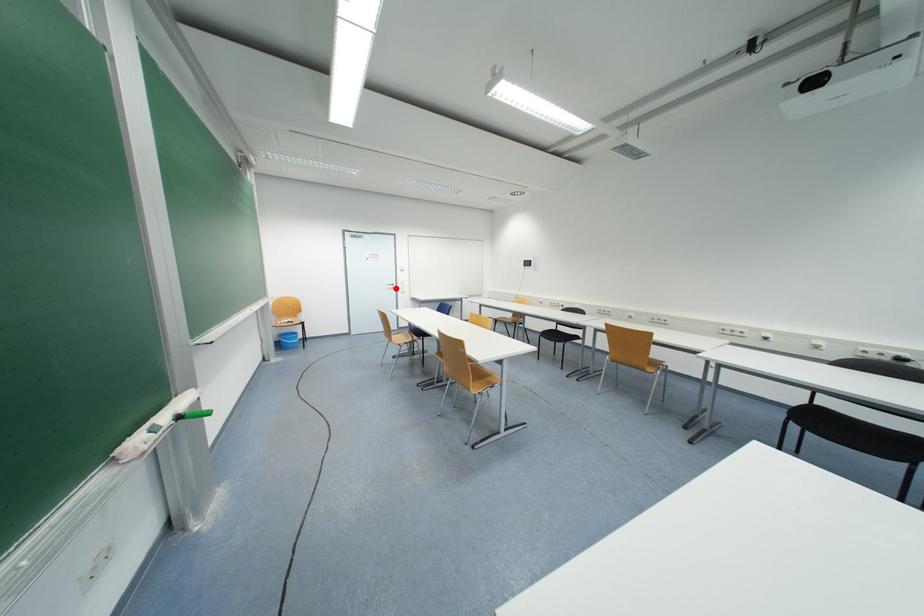
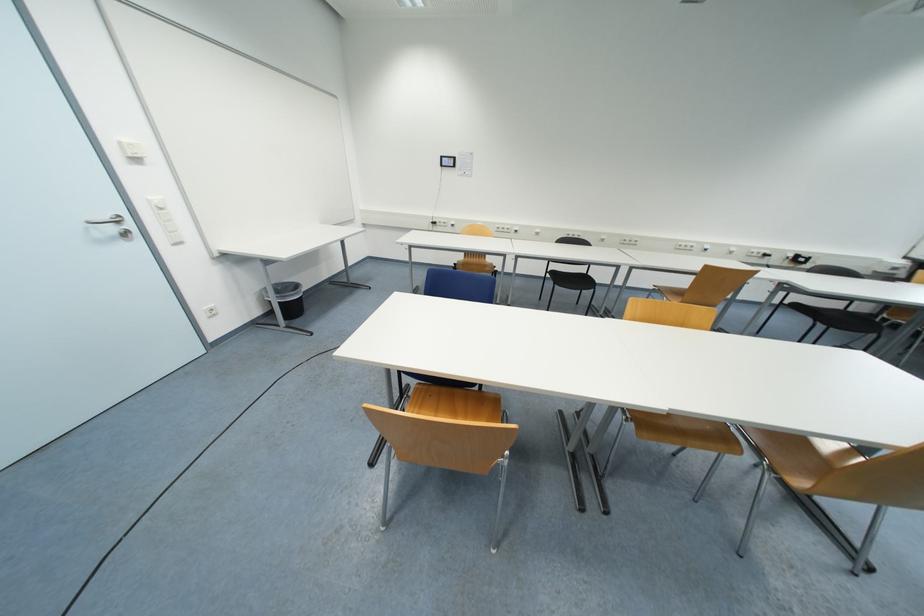
In the second image, find the point that corresponds to the highlighted location in the first image.

(117, 230)